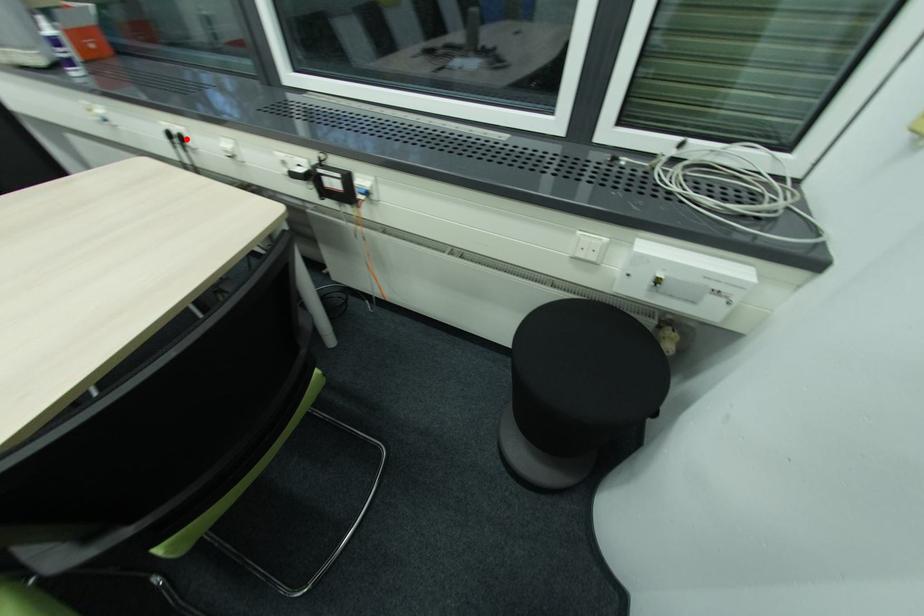
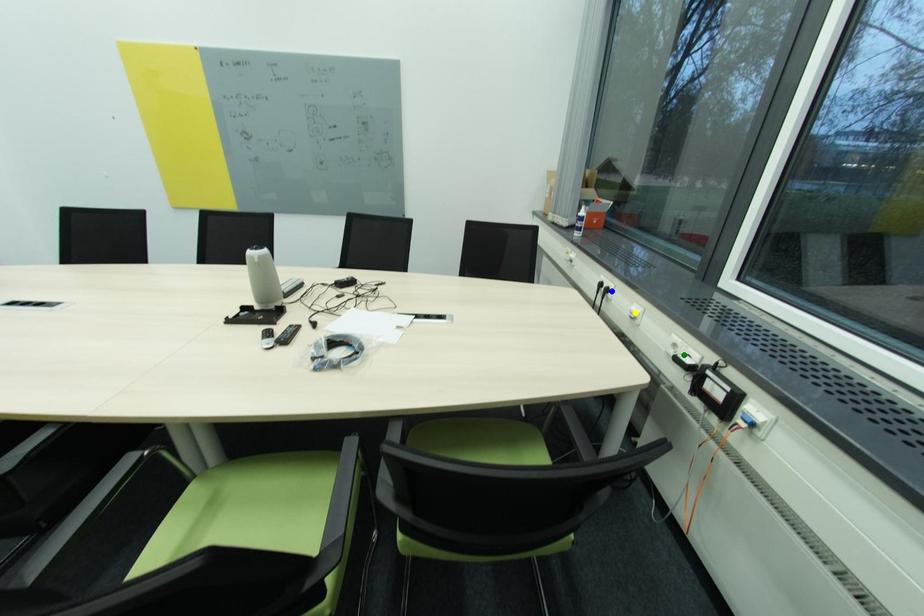
Question: I am providing you with two images of the same scene from different viewpoints. A red point is marked on the first image. You are given multiple points on the second image. Which spot in image 2 lines up with the point in image 1?

Choices:
 (A) blue point
 (B) green point
 (C) yellow point

Answer: (A)